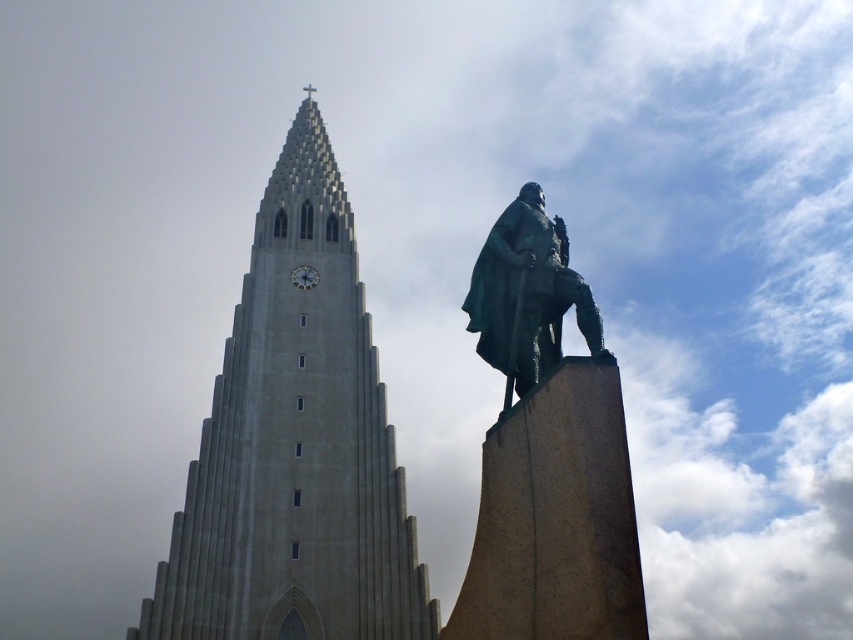
Is point (196, 460) farther from viewer compared to point (561, 264)?

Yes, point (196, 460) is behind point (561, 264).

Is point (386, 531) less distant than point (573, 282)?

No, it is behind (573, 282).

Describe the element at coordinates (294, 445) in the screenshot. I see `gray stone tower at center` at that location.

This screenshot has height=640, width=853. In order to click on gray stone tower at center in this screenshot , I will do `click(294, 445)`.